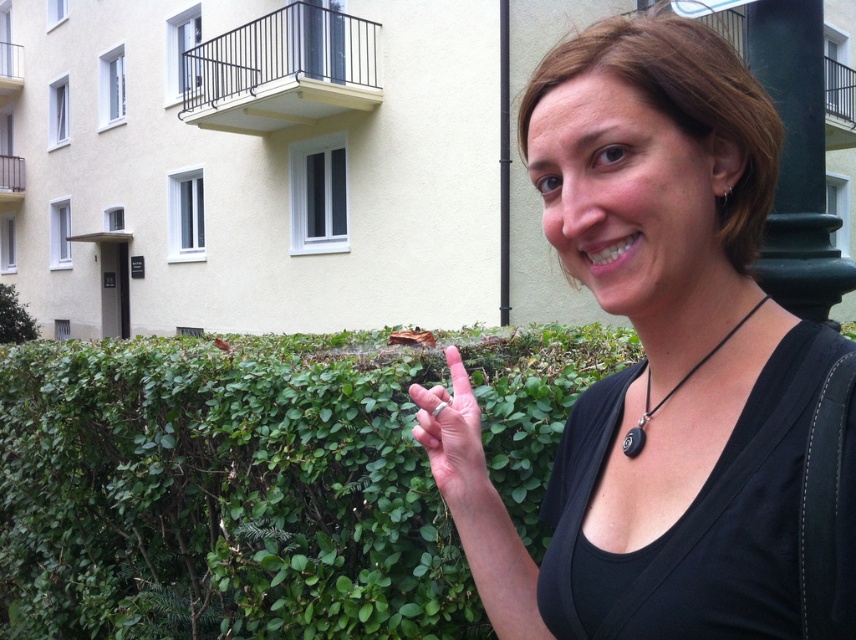
Between point (752, 333) and point (456, 449), which one is positioned in front?

Point (752, 333) is more forward.

Does black matte necklace at upper right appear over silver metallic ring at center?

Yes, black matte necklace at upper right is above silver metallic ring at center.

The height and width of the screenshot is (640, 856). What do you see at coordinates (663, 349) in the screenshot?
I see `black matte necklace at upper right` at bounding box center [663, 349].

This screenshot has width=856, height=640. I want to click on black matte necklace at upper right, so click(x=663, y=349).

Can you confirm if silver metallic ring at center is smaller than black matte pendant at lower right?

Actually, silver metallic ring at center might be larger than black matte pendant at lower right.

Does silver metallic ring at center have a lesser width compared to black matte pendant at lower right?

Correct, silver metallic ring at center's width is less than black matte pendant at lower right's.

This screenshot has height=640, width=856. What are the coordinates of `silver metallic ring at center` in the screenshot? It's located at (455, 444).

The width and height of the screenshot is (856, 640). In order to click on silver metallic ring at center in this screenshot , I will do `click(455, 444)`.

Does point (584, 147) lie behind point (91, 342)?

No, it is not.

Does black matte necklace at upper right have a smaller size compared to green leafy hedge at center?

Yes.

The width and height of the screenshot is (856, 640). What do you see at coordinates (663, 349) in the screenshot?
I see `black matte necklace at upper right` at bounding box center [663, 349].

Where is `black matte necklace at upper right`? This screenshot has width=856, height=640. black matte necklace at upper right is located at coordinates (663, 349).